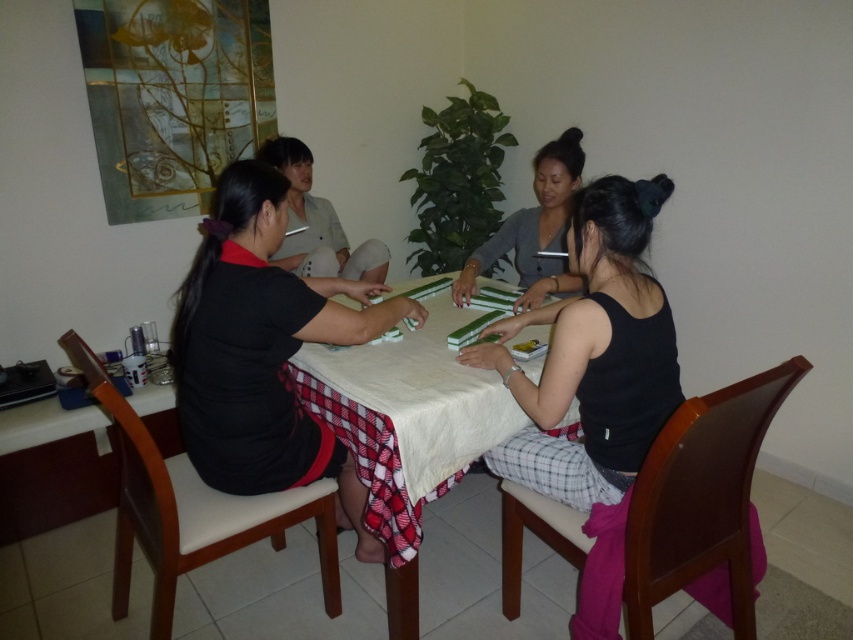
Question: Which point appears closest to the camera in this image?

Choices:
 (A) (277, 410)
 (B) (438, 381)
 (C) (596, 454)

Answer: (C)

Question: Which point is closer to the camera?

Choices:
 (A) pos(541,266)
 (B) pos(398,625)

Answer: (B)

Question: Is black matte shirt at center behind white cloth-covered table at center?

Choices:
 (A) yes
 (B) no

Answer: (B)

Question: Is white cloth-covered table at center to the right of gray matte shirt at center from the viewer's perspective?

Choices:
 (A) no
 (B) yes

Answer: (A)

Question: Which point is closer to the camera taking this photo?

Choices:
 (A) (276, 342)
 (B) (584, 406)
 (C) (445, 452)
 (D) (315, 205)

Answer: (A)

Question: Can you confirm if black matte tank top at lower right is thinner than gray matte shirt at center?

Choices:
 (A) yes
 (B) no

Answer: (B)